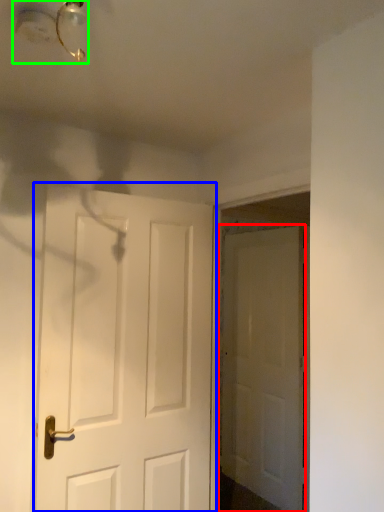
Question: Based on their relative distances, which object is nearer to door (highlighted by a red box)? Choose from door (highlighted by a blue box) and light fixture (highlighted by a green box).

Choices:
 (A) door
 (B) light fixture

Answer: (A)